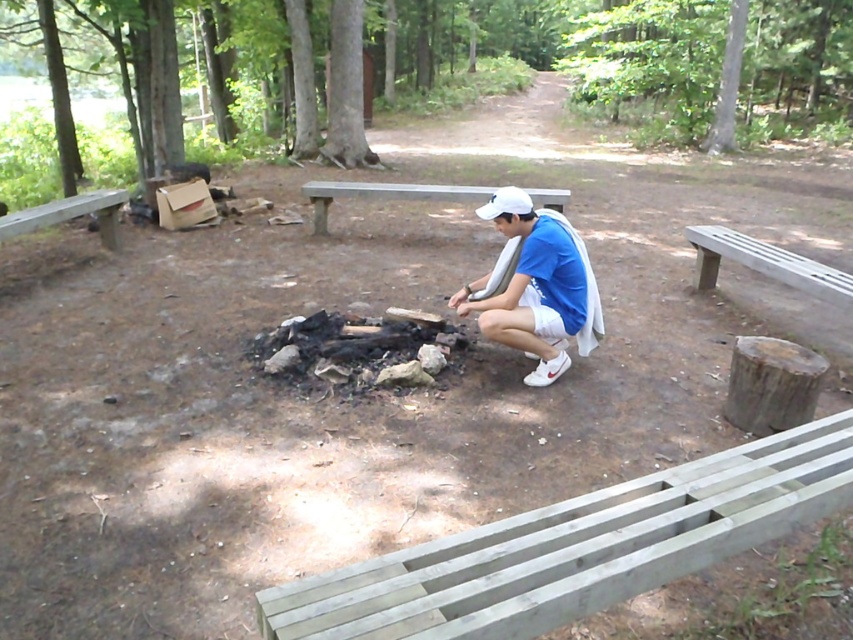
You are planning to sit on one of the benches in the campsite. Which bench, the gray wooden bench at lower right or the wooden bench at center, would be more comfortable for someone who prefers a taller seat?

The wooden bench at center is taller than the gray wooden bench at lower right, so it would be more comfortable for someone who prefers a taller seat.

You are standing at the camera position looking at the scene. There are two points marked in the image, one at coordinates point (772, 452) and the other at point (9, 256). Which of these points is nearer to you?

Point (772, 452) is closer to the camera than point (9, 256), so the point at coordinates point (772, 452) is nearer to you.